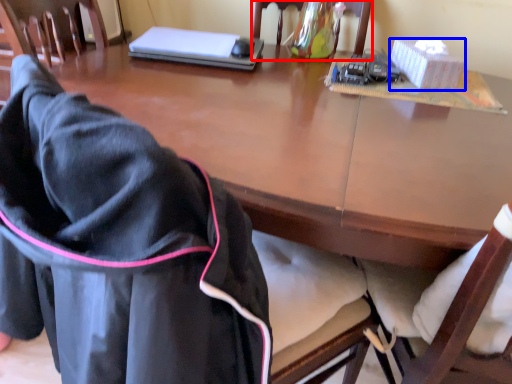
Question: Which object is closer to the camera taking this photo, chair (highlighted by a red box) or box (highlighted by a blue box)?

Choices:
 (A) chair
 (B) box

Answer: (A)